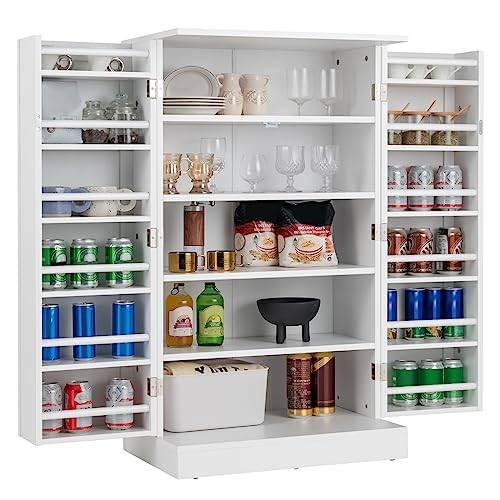
The height and width of the screenshot is (500, 500). I want to click on plates, so click(189, 108), click(191, 103), click(193, 100), click(196, 98), click(199, 80).